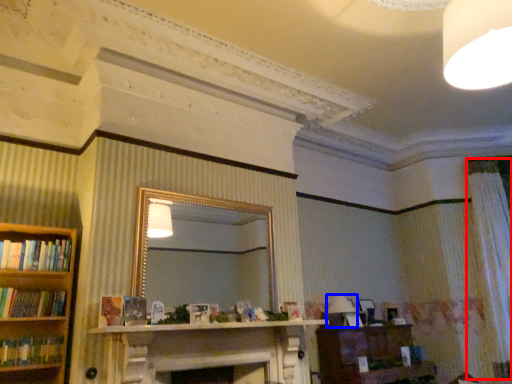
Question: Which object appears farthest to the camera in this image, curtain (highlighted by a red box) or lamp (highlighted by a blue box)?

Choices:
 (A) curtain
 (B) lamp

Answer: (A)